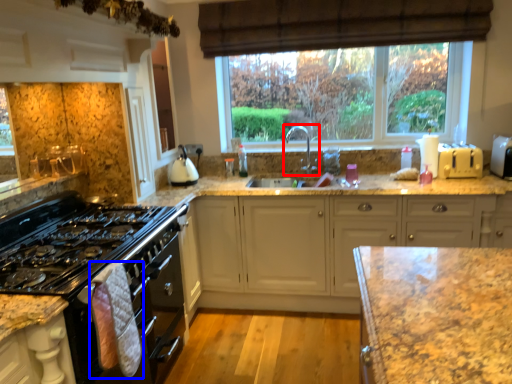
Question: Which of the following is the farthest to the observer, tap (highlighted by a red box) or material (highlighted by a blue box)?

Choices:
 (A) tap
 (B) material

Answer: (A)